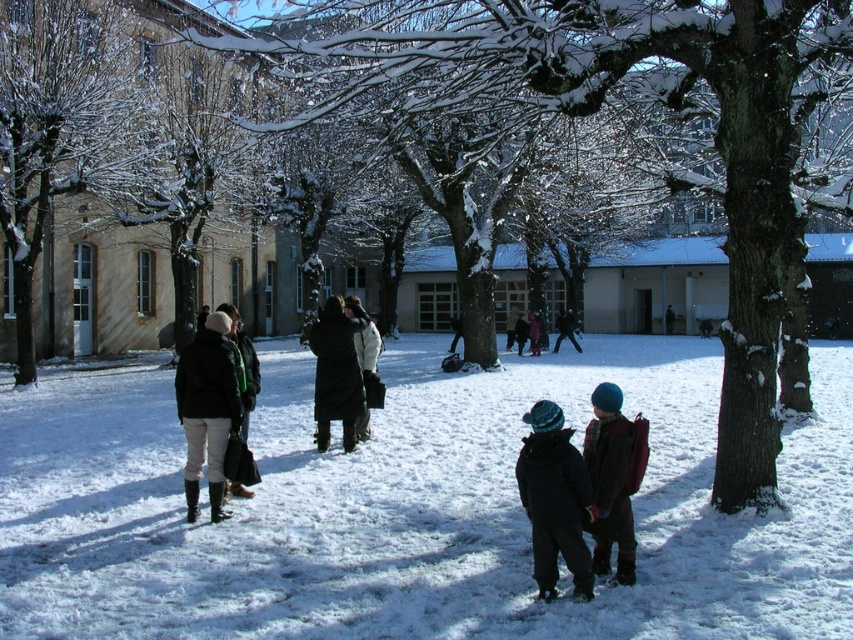
Is plaid woolen sweater at center shorter than dark gray wool coat at center?

Yes, plaid woolen sweater at center is shorter than dark gray wool coat at center.

Is plaid woolen sweater at center to the right of dark gray wool coat at center from the viewer's perspective?

No, plaid woolen sweater at center is not to the right of dark gray wool coat at center.

Does point (593, 406) come in front of point (531, 317)?

Yes, point (593, 406) is in front of point (531, 317).

In order to click on plaid woolen sweater at center in this screenshot , I will do `click(613, 477)`.

Between white leather boots at left and black wool coat at center, which one appears on the left side from the viewer's perspective?

white leather boots at left

Which is behind, point (209, 397) or point (344, 422)?

Positioned behind is point (344, 422).

In order to click on white leather boots at left in this screenshot , I will do `click(207, 410)`.

The height and width of the screenshot is (640, 853). What do you see at coordinates (61, 125) in the screenshot?
I see `snow-covered tree at left` at bounding box center [61, 125].

Can you confirm if snow-covered tree at left is shorter than dark gray wool coat at center?

In fact, snow-covered tree at left may be taller than dark gray wool coat at center.

The image size is (853, 640). Find the location of `snow-covered tree at left`. snow-covered tree at left is located at coordinates (61, 125).

The width and height of the screenshot is (853, 640). I want to click on snow-covered tree at left, so click(x=61, y=125).